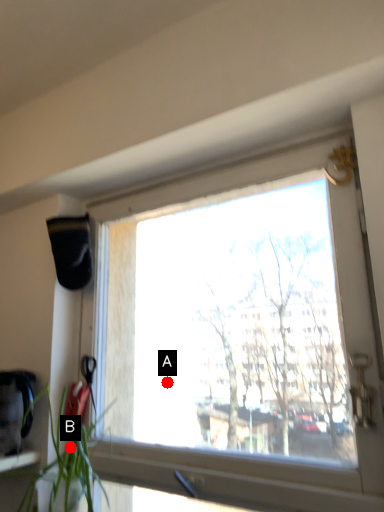
Question: Two points are circled on the image, labeled by A and B beside each circle. Which of the following is the farthest from the observer?

Choices:
 (A) A is further
 (B) B is further

Answer: (A)